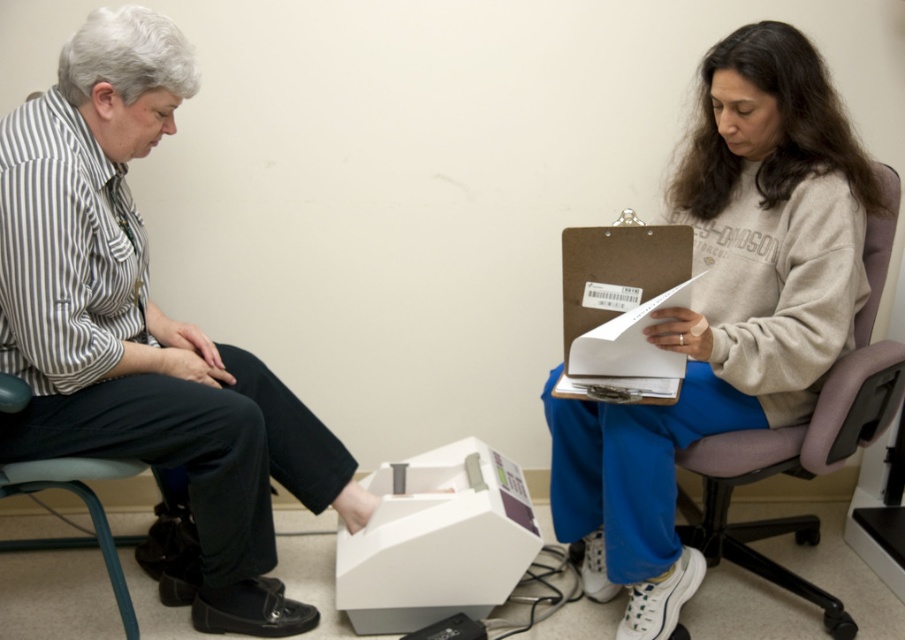
You are a photographer standing in front of the scene. You want to take a closeup photo of the matte black shoe at lower left without moving the camera. Is the shoe within the camera focus range of 1.5 meters?

The matte black shoe at lower left is 1.40 meters from camera, so yes, it is within the camera focus range of 1.5 meters.

You are a physical therapist assessing a patient in an office. You need to place a new exercise chart on the wall between the matte black shoe at lower left and the gray fabric armchair at right. Based on their positions, where should you place it to ensure it is equidistant from both objects?

The exercise chart should be placed exactly halfway between the matte black shoe at lower left and the gray fabric armchair at right since the shoe is to the left of the armchair, creating a central point between them.

You are a delivery person who needs to place a large package between the matte black shoe at lower left and the gray fabric armchair at right. Can you fit it there?

The matte black shoe at lower left has a larger size compared to gray fabric armchair at right, so there might be enough space to fit the large package between them depending on the exact dimensions of the package and the distance between the two objects.